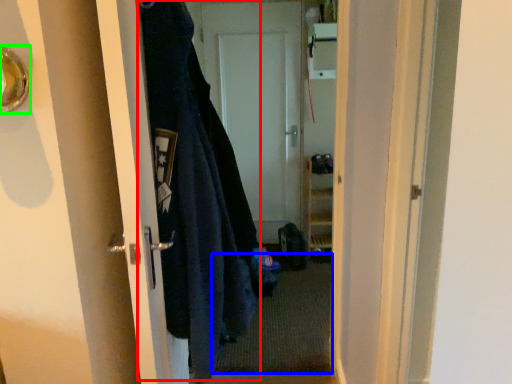
Question: Which object is the farthest from garment (highlighted by a red box)? Choose among these: doormat (highlighted by a blue box) or door handle (highlighted by a green box).

Choices:
 (A) doormat
 (B) door handle

Answer: (A)